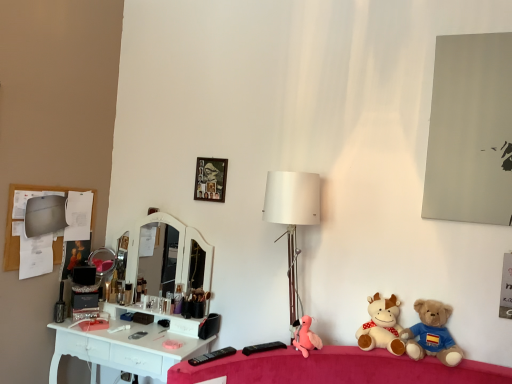
Locate an element on the screen. This screenshot has width=512, height=384. matte black makeup brush at left is located at coordinates (178, 298).

Measure the distance between point (380, 310) and camera.

A distance of 6.82 feet exists between point (380, 310) and camera.

Describe the element at coordinates (382, 326) in the screenshot. This screenshot has width=512, height=384. I see `soft plush cow at lower right, acting as the second toy starting from the right` at that location.

The image size is (512, 384). Describe the element at coordinates (432, 334) in the screenshot. I see `brown plush bear at lower right, which appears as the first toy when viewed from the right` at that location.

Where is `brown plush bear at lower right, which is the 3th toy in left-to-right order`? The height and width of the screenshot is (384, 512). brown plush bear at lower right, which is the 3th toy in left-to-right order is located at coordinates (432, 334).

Based on the photo, measure the distance between point (476, 153) and camera.

A distance of 2.03 meters exists between point (476, 153) and camera.

Where is `matte black makeup brush at left`? matte black makeup brush at left is located at coordinates (178, 298).

From a real-world perspective, relative to pink plush at center, acting as the 3th toy starting from the right, is matte black makeup brush at left vertically above or below?

matte black makeup brush at left is below pink plush at center, acting as the 3th toy starting from the right.

Is matte black makeup brush at left not close to pink plush at center, acting as the first toy starting from the left?

No, matte black makeup brush at left is not far away from pink plush at center, acting as the first toy starting from the left.

From the image's perspective, between matte black makeup brush at left and pink plush at center, acting as the first toy starting from the left, who is located below?

pink plush at center, acting as the first toy starting from the left, from the image's perspective.

Is matte black makeup brush at left aimed at pink plush at center, acting as the first toy starting from the left?

No, matte black makeup brush at left is not turned towards pink plush at center, acting as the first toy starting from the left.

Is soft plush cow at lower right, acting as the second toy starting from the left, closer to camera compared to white matte table lamp at center?

That is True.

Could white matte table lamp at center be considered to be inside soft plush cow at lower right, acting as the second toy starting from the left?

No, white matte table lamp at center is located outside of soft plush cow at lower right, acting as the second toy starting from the left.

Does soft plush cow at lower right, acting as the second toy starting from the left, turn towards white matte table lamp at center?

No, soft plush cow at lower right, acting as the second toy starting from the left, is not turned towards white matte table lamp at center.

Is soft plush cow at lower right, acting as the second toy starting from the left, directly adjacent to white matte table lamp at center?

No, soft plush cow at lower right, acting as the second toy starting from the left, is not next to white matte table lamp at center.

Measure the distance from wooden photo frame at upper center to pink plush at center, acting as the 3th toy starting from the right.

wooden photo frame at upper center is 37.27 inches away from pink plush at center, acting as the 3th toy starting from the right.

Based on the photo, would you say wooden photo frame at upper center is outside pink plush at center, acting as the first toy starting from the left?

Yes, wooden photo frame at upper center is not within pink plush at center, acting as the first toy starting from the left.

Between wooden photo frame at upper center and pink plush at center, acting as the 3th toy starting from the right, which one has smaller size?

With smaller size is wooden photo frame at upper center.

In the scene shown: From the image's perspective, which one is positioned lower, wooden photo frame at upper center or pink plush at center, acting as the 3th toy starting from the right?

pink plush at center, acting as the 3th toy starting from the right, from the image's perspective.

From a real-world perspective, is matte black makeup brush at left on top of matte gray mirror at upper right?

No.

Which object is positioned more to the left, matte black makeup brush at left or matte gray mirror at upper right?

From the viewer's perspective, matte black makeup brush at left appears more on the left side.

Considering the relative sizes of matte black makeup brush at left and matte gray mirror at upper right in the image provided, is matte black makeup brush at left thinner than matte gray mirror at upper right?

No.

Find the location of a particular element. This screenshot has width=512, height=384. toiletry below the matte gray mirror at upper right (from a real-world perspective) is located at coordinates (x=178, y=298).

Considering the sizes of objects soft plush cow at lower right, acting as the second toy starting from the right, and brown plush bear at lower right, which is the 3th toy in left-to-right order, in the image provided, who is smaller, soft plush cow at lower right, acting as the second toy starting from the right, or brown plush bear at lower right, which is the 3th toy in left-to-right order,?

soft plush cow at lower right, acting as the second toy starting from the right, is smaller.

Based on the photo, can you confirm if soft plush cow at lower right, acting as the second toy starting from the left, is positioned to the right of brown plush bear at lower right, which appears as the first toy when viewed from the right?

In fact, soft plush cow at lower right, acting as the second toy starting from the left, is to the left of brown plush bear at lower right, which appears as the first toy when viewed from the right.

How much distance is there between soft plush cow at lower right, acting as the second toy starting from the left, and brown plush bear at lower right, which appears as the first toy when viewed from the right?

They are 5.00 inches apart.

Which object is thinner, soft plush cow at lower right, acting as the second toy starting from the right, or brown plush bear at lower right, which appears as the first toy when viewed from the right?

With smaller width is brown plush bear at lower right, which appears as the first toy when viewed from the right.

Who is bigger, white matte table lamp at center or matte gray mirror at upper right?

Bigger between the two is white matte table lamp at center.

Is white matte table lamp at center inside the boundaries of matte gray mirror at upper right, or outside?

white matte table lamp at center cannot be found inside matte gray mirror at upper right.

Is white matte table lamp at center shorter than matte gray mirror at upper right?

Incorrect, the height of white matte table lamp at center does not fall short of that of matte gray mirror at upper right.

From a real-world perspective, is matte black makeup brush at left physically below wooden photo frame at upper center?

Yes, from a real-world perspective, matte black makeup brush at left is under wooden photo frame at upper center.

Is point (181, 301) in front of point (218, 170)?

That is True.

Considering the sizes of objects matte black makeup brush at left and wooden photo frame at upper center in the image provided, who is bigger, matte black makeup brush at left or wooden photo frame at upper center?

wooden photo frame at upper center.

From the image's perspective, which is below, matte black makeup brush at left or wooden photo frame at upper center?

From the image's view, matte black makeup brush at left is below.

Starting from the matte black makeup brush at left, which toy is the 1st one to the right? Please provide its 2D coordinates.

[(306, 336)]

Where is `table lamp that appears on the left of soft plush cow at lower right, acting as the second toy starting from the left`? The height and width of the screenshot is (384, 512). table lamp that appears on the left of soft plush cow at lower right, acting as the second toy starting from the left is located at coordinates [x=292, y=217].

Estimate the real-world distances between objects in this image. Which object is further from matte gray mirror at upper right, wooden photo frame at upper center or soft plush cow at lower right, acting as the second toy starting from the left?

wooden photo frame at upper center is positioned further to the anchor matte gray mirror at upper right.

Looking at the image, which one is located further to wooden photo frame at upper center, brown plush bear at lower right, which is the 3th toy in left-to-right order, or white matte table lamp at center?

The object further to wooden photo frame at upper center is brown plush bear at lower right, which is the 3th toy in left-to-right order.

Based on their spatial positions, is soft plush cow at lower right, acting as the second toy starting from the left, or pink plush at center, acting as the first toy starting from the left, further from brown plush bear at lower right, which is the 3th toy in left-to-right order?

pink plush at center, acting as the first toy starting from the left.

Looking at the image, which one is located further to matte black makeup brush at left, soft plush cow at lower right, acting as the second toy starting from the left, or wooden photo frame at upper center?

Based on the image, soft plush cow at lower right, acting as the second toy starting from the left, appears to be further to matte black makeup brush at left.

Estimate the real-world distances between objects in this image. Which object is further from matte gray mirror at upper right, wooden photo frame at upper center or pink plush at center, acting as the 3th toy starting from the right?

wooden photo frame at upper center is positioned further to the anchor matte gray mirror at upper right.

Based on their spatial positions, is brown plush bear at lower right, which is the 3th toy in left-to-right order, or white matte table lamp at center further from matte black makeup brush at left?

brown plush bear at lower right, which is the 3th toy in left-to-right order, is further to matte black makeup brush at left.

From the image, which object appears to be farther from brown plush bear at lower right, which appears as the first toy when viewed from the right, white matte table lamp at center or matte gray mirror at upper right?

matte gray mirror at upper right is positioned further to the anchor brown plush bear at lower right, which appears as the first toy when viewed from the right.

Looking at the image, which one is located further to matte black makeup brush at left, white matte table lamp at center or soft plush cow at lower right, acting as the second toy starting from the left?

Based on the image, soft plush cow at lower right, acting as the second toy starting from the left, appears to be further to matte black makeup brush at left.

Find the location of a particular element. The width and height of the screenshot is (512, 384). toiletry that lies between wooden photo frame at upper center and pink plush at center, acting as the 3th toy starting from the right, from top to bottom is located at coordinates (178, 298).

Locate an element on the screen. picture frame located between matte black makeup brush at left and brown plush bear at lower right, which is the 3th toy in left-to-right order, in the left-right direction is located at coordinates (210, 179).

What are the coordinates of `table lamp between wooden photo frame at upper center and pink plush at center, acting as the first toy starting from the left, in the vertical direction` in the screenshot? It's located at point(292,217).

This screenshot has width=512, height=384. I want to click on table lamp situated between matte black makeup brush at left and matte gray mirror at upper right from left to right, so click(292, 217).